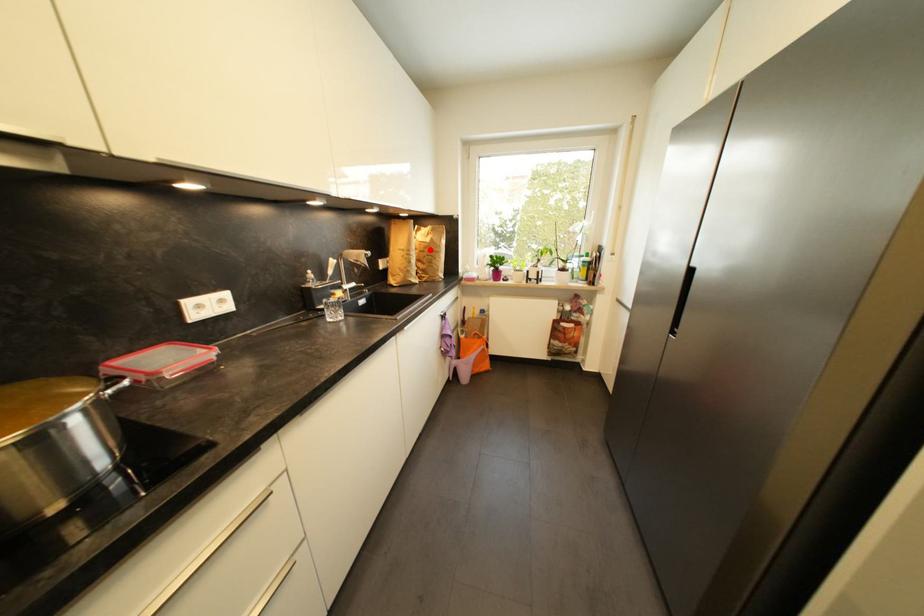
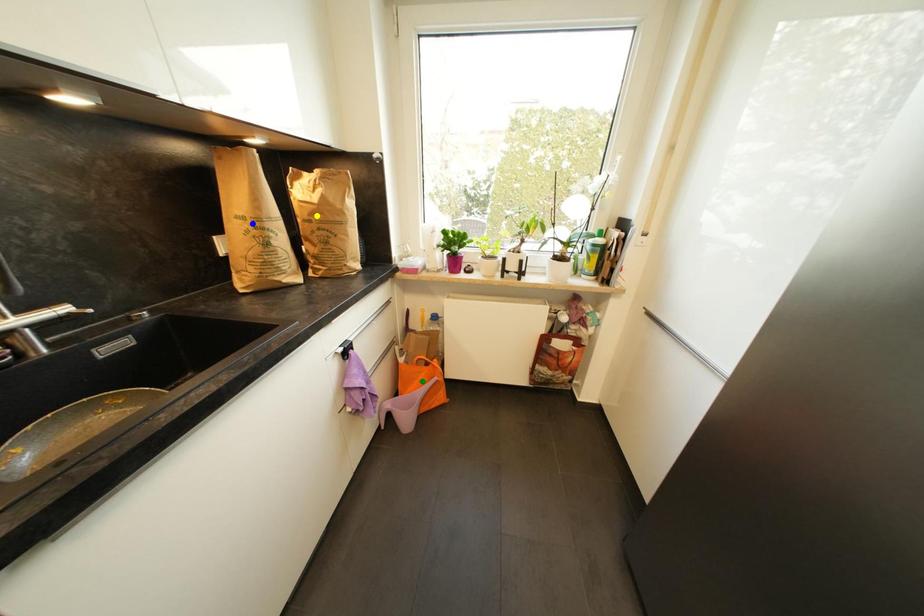
Question: I am providing you with two images of the same scene from different viewpoints. A red point is marked on the first image. You are given multiple points on the second image. Which point in image 2 is actually the same real-world point as the red point in image 1?

Choices:
 (A) green point
 (B) yellow point
 (C) blue point

Answer: (B)